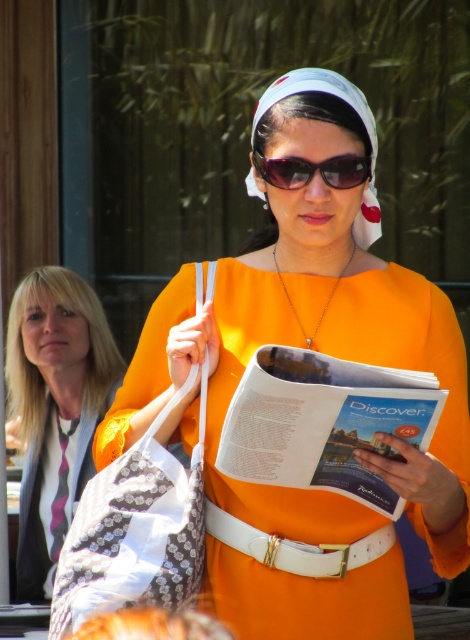
Does blonde hair at left appear over patterned fabric bag at center?

No, blonde hair at left is not above patterned fabric bag at center.

Which is above, blonde hair at left or patterned fabric bag at center?

patterned fabric bag at center is above.

Who is more forward, (48, 596) or (188, 557)?

Point (188, 557) is more forward.

Where is `blonde hair at left`? The image size is (470, 640). blonde hair at left is located at coordinates (54, 408).

Who is taller, orange matte dress at center or matte paper magazine at center?

Standing taller between the two is orange matte dress at center.

Is orange matte dress at center above matte paper magazine at center?

Correct, orange matte dress at center is located above matte paper magazine at center.

At what (x,y) coordinates should I click in order to perform the action: click on orange matte dress at center. Please return your answer as a coordinate pair (x, y). Image resolution: width=470 pixels, height=640 pixels. Looking at the image, I should click on (321, 352).

The height and width of the screenshot is (640, 470). I want to click on orange matte dress at center, so click(x=321, y=352).

Does point (350, 536) lie in front of point (115, 557)?

No, (350, 536) is further to viewer.

Is orange matte dress at center to the right of patterned fabric bag at center from the viewer's perspective?

Yes, orange matte dress at center is to the right of patterned fabric bag at center.

Who is more distant from viewer, (122,451) or (194,588)?

The point (122,451) is behind.

Locate an element on the screen. Image resolution: width=470 pixels, height=640 pixels. orange matte dress at center is located at coordinates (321, 352).